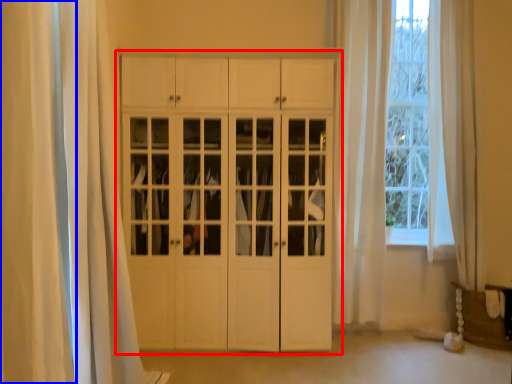
Question: Which point is further to the camera, cupboard (highlighted by a red box) or curtain (highlighted by a blue box)?

Choices:
 (A) cupboard
 (B) curtain

Answer: (A)